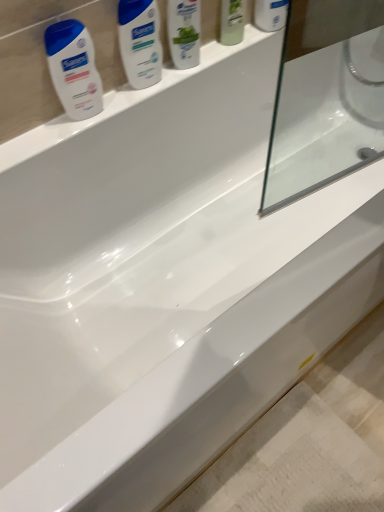
Question: Is white glossy lotion at upper left, the first cleaning product from the bottom, in front of or behind white glossy shampoo at upper center, placed as the 2th cleaning product when sorted from bottom to top, in the image?

Choices:
 (A) behind
 (B) front

Answer: (B)

Question: Considering the positions of white glossy lotion at upper left, which ranks as the 2th cleaning product in top-to-bottom order, and white glossy shampoo at upper center, positioned as the first cleaning product in top-to-bottom order, in the image, is white glossy lotion at upper left, which ranks as the 2th cleaning product in top-to-bottom order, bigger or smaller than white glossy shampoo at upper center, positioned as the first cleaning product in top-to-bottom order,?

Choices:
 (A) small
 (B) big

Answer: (A)

Question: Considering the real-world distances, which object is closest to the white glossy shampoo at upper center, placed as the 2th cleaning product when sorted from bottom to top?

Choices:
 (A) white glossy lotion at upper left
 (B) green matte mouthwash at upper center, placed as the 1th mouthwash when sorted from left to right
 (C) white glossy mouthwash at upper center, the second mouthwash in the left-to-right sequence
 (D) white glossy lotion at upper left, marked as the 2th cleaning product in a right-to-left arrangement

Answer: (A)

Question: Based on their relative distances, which object is nearer to the white glossy mouthwash at upper center, which is counted as the 1th mouthwash, starting from the right?

Choices:
 (A) green matte mouthwash at upper center, placed as the 1th mouthwash when sorted from left to right
 (B) white glossy lotion at upper left
 (C) white glossy lotion at upper left, which ranks as the 2th cleaning product in top-to-bottom order
 (D) white glossy shampoo at upper center, placed as the 2th cleaning product when sorted from bottom to top

Answer: (A)